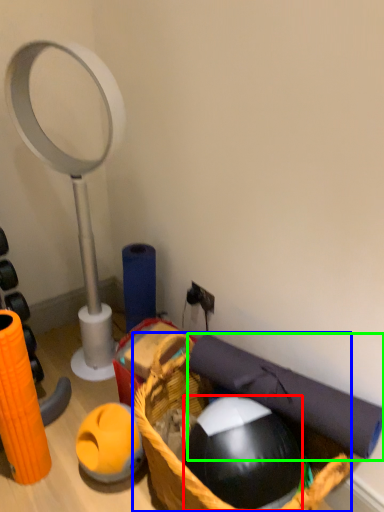
Question: Based on their relative distances, which object is farther from ball (highlighted by a red box)? Choose from basket (highlighted by a blue box) and yoga mat (highlighted by a green box).

Choices:
 (A) basket
 (B) yoga mat

Answer: (B)